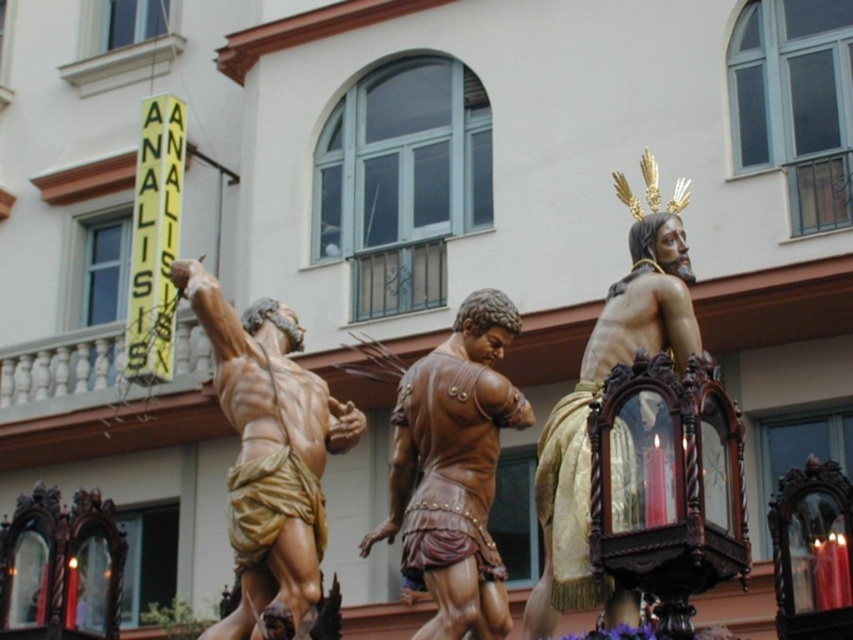
Consider the image. Does matte gold statue at center appear on the right side of gold polished statue at center?

Incorrect, matte gold statue at center is not on the right side of gold polished statue at center.

At what (x,y) coordinates should I click in order to perform the action: click on matte gold statue at center. Please return your answer as a coordinate pair (x, y). Looking at the image, I should click on (270, 456).

This screenshot has height=640, width=853. I want to click on matte gold statue at center, so click(270, 456).

Who is positioned more to the left, matte gold statue at center or brown polished wood statue at center?

matte gold statue at center

Can you confirm if matte gold statue at center is positioned below brown polished wood statue at center?

Correct, matte gold statue at center is located below brown polished wood statue at center.

Who is more forward, (235, 493) or (463, 419)?

Positioned in front is point (463, 419).

Where is `matte gold statue at center`? matte gold statue at center is located at coordinates (270, 456).

Who is higher up, brown polished wood statue at center or gold polished statue at center?

Positioned higher is gold polished statue at center.

Can you confirm if brown polished wood statue at center is taller than gold polished statue at center?

No, brown polished wood statue at center is not taller than gold polished statue at center.

Identify the location of brown polished wood statue at center. The height and width of the screenshot is (640, 853). (454, 468).